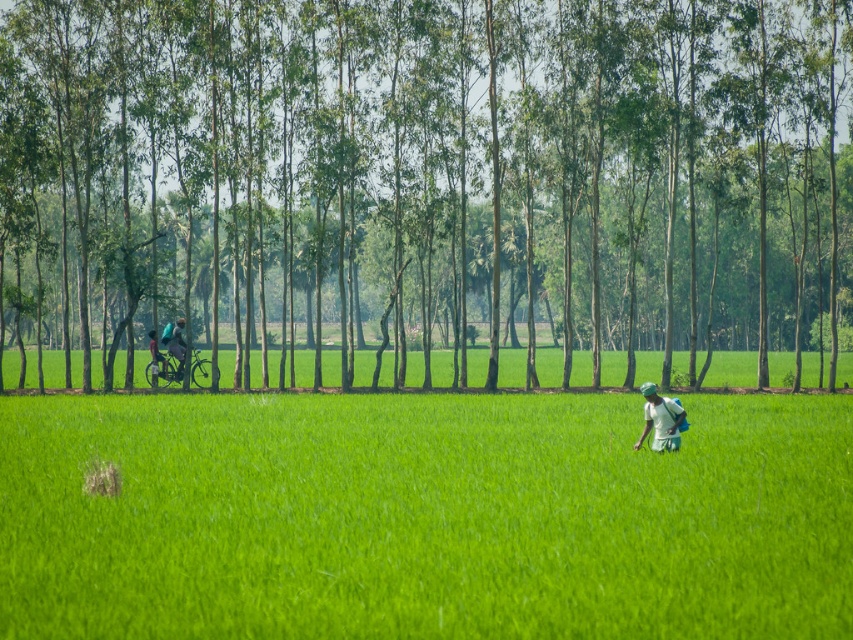
Between white fabric shirt at lower right and dark blue fabric bicycle at left, which one has more height?

Standing taller between the two is dark blue fabric bicycle at left.

Is point (674, 416) positioned before point (177, 333)?

Yes, point (674, 416) is in front of point (177, 333).

Does point (650, 401) come farther from viewer compared to point (183, 349)?

No.

The height and width of the screenshot is (640, 853). I want to click on white fabric shirt at lower right, so click(x=660, y=419).

Can you confirm if green leafy tree at center is smaller than green grass at center?

No, green leafy tree at center is not smaller than green grass at center.

You are a GUI agent. You are given a task and a screenshot of the screen. Output one action in this format:
    pyautogui.click(x=<x>, y=<y>)
    Task: Click on the green leafy tree at center
    This screenshot has width=853, height=640.
    Given the screenshot: What is the action you would take?
    pyautogui.click(x=425, y=182)

The image size is (853, 640). Identify the location of green leafy tree at center. (425, 182).

Does green leafy tree at center have a larger size compared to dark blue fabric bicycle at left?

Yes.

Between point (648, 77) and point (177, 353), which one is positioned behind?

Point (177, 353)

Where is `green leafy tree at center`? The image size is (853, 640). green leafy tree at center is located at coordinates (425, 182).

The width and height of the screenshot is (853, 640). What are the coordinates of `green leafy tree at center` in the screenshot? It's located at (425, 182).